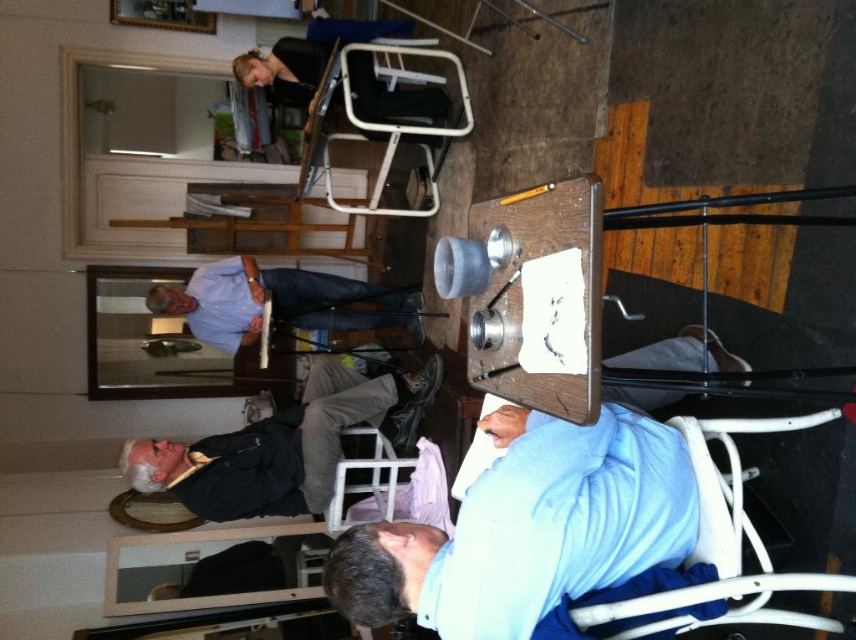
You are standing in the room and want to pick up the black leather jacket at lower left. Can you reach it without moving the white plastic chair at upper center?

The black leather jacket at lower left is closer to the viewer than the white plastic chair at upper center, so yes, you can reach it without moving the chair.

Based on the scene description, can you determine if the blue shirt at center is wider than the white plastic chair at upper center?

The blue shirt at center might be wider than the white plastic chair at upper center according to the description provided.

You are trying to find the blue shirt at center in the rotated image. According to the scene description, where would you look relative to the white plastic chair at upper center?

The blue shirt at center is located below the white plastic chair at upper center.